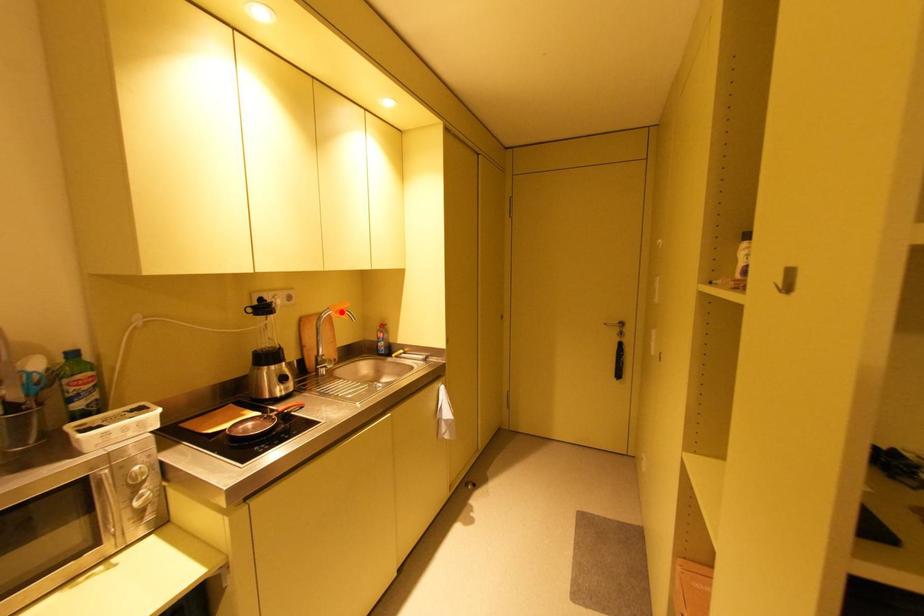
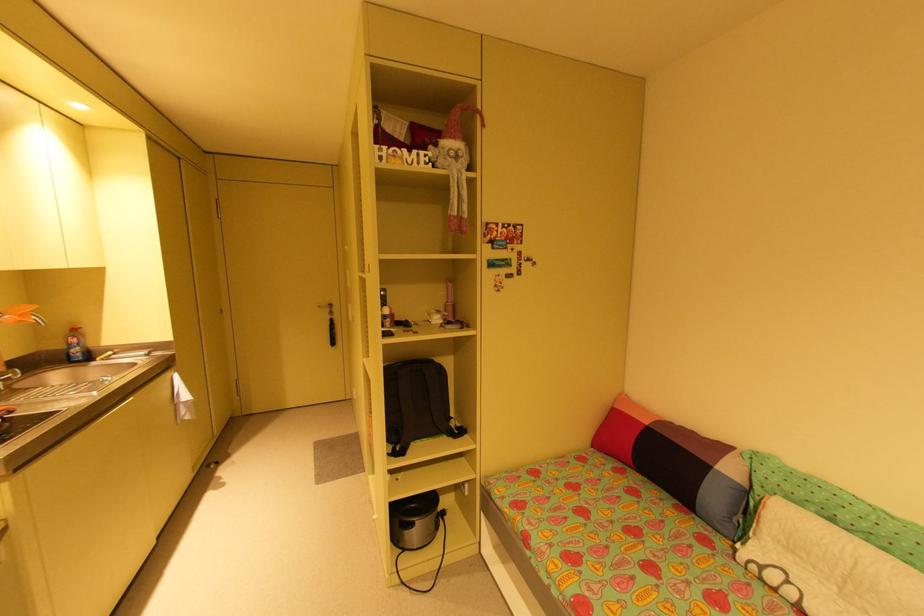
In the second image, find the point that corresponds to the highlighted location in the first image.

(25, 315)